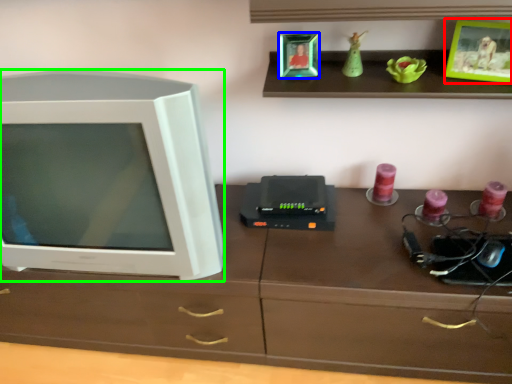
Question: Estimate the real-world distances between objects in this image. Which object is farther from picture frame (highlighted by a red box), picture frame (highlighted by a blue box) or television (highlighted by a green box)?

Choices:
 (A) picture frame
 (B) television

Answer: (B)